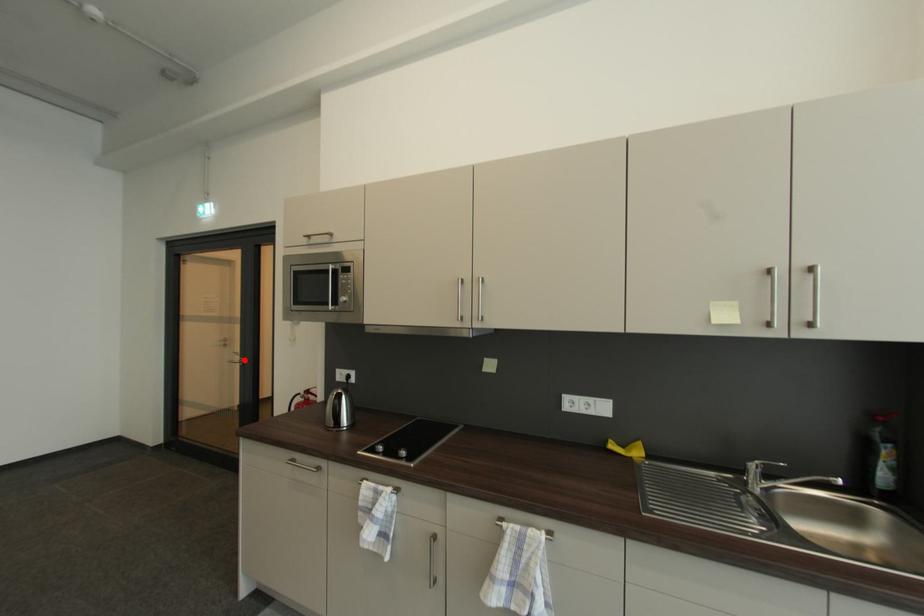
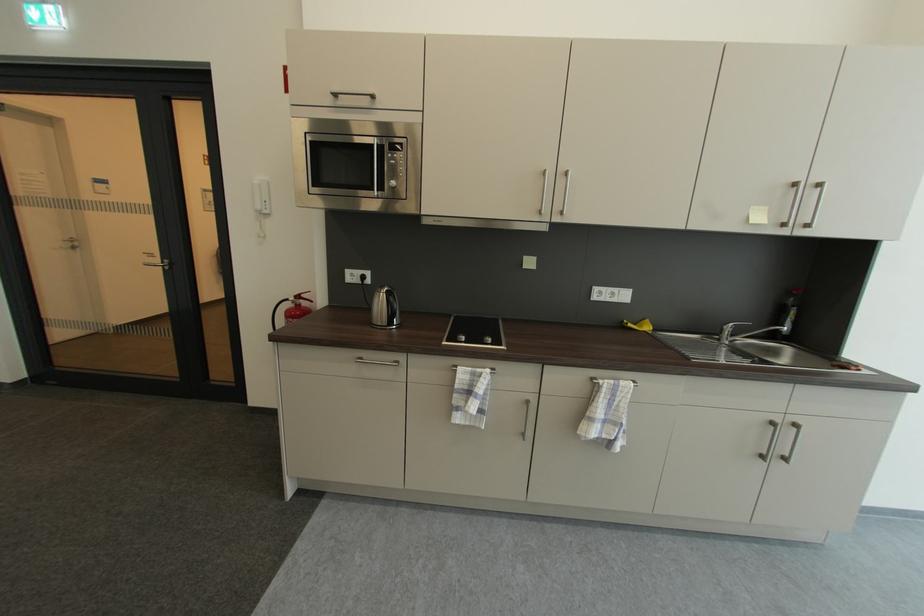
The point at the highlighted location is marked in the first image. Where is the corresponding point in the second image?

(163, 262)